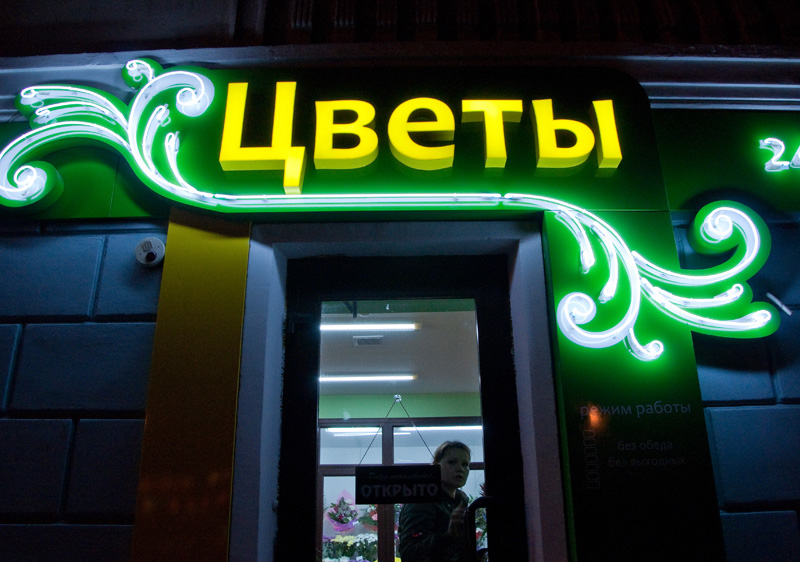
In order to click on door frame in this screenshot , I will do `click(376, 241)`.